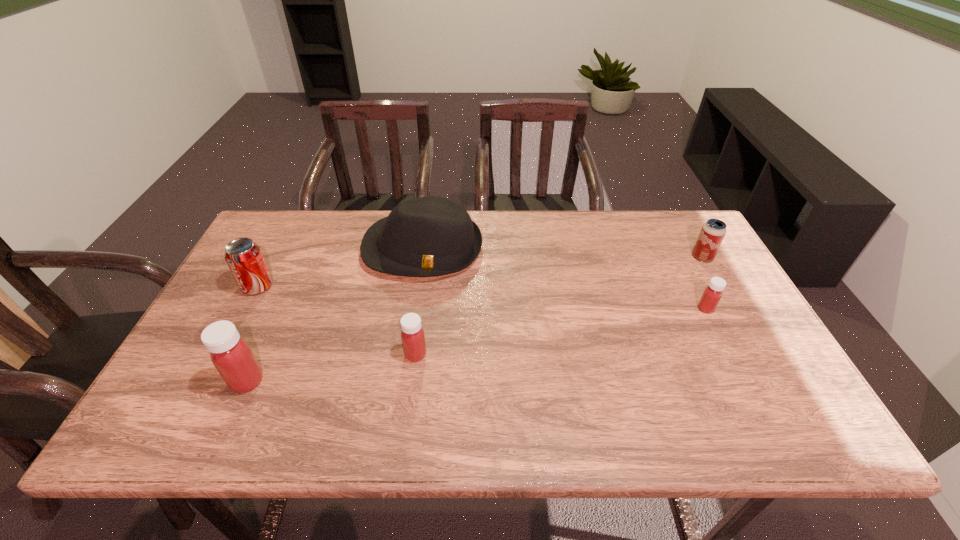
To achieve uniform spacing by inserting another medicine among them, please point to a free space for this new medicine. Please provide its 2D coordinates. Your answer should be formatted as a tuple, i.e. [(x, y)], where the tuple contains the x and y coordinates of a point satisfying the conditions above.

[(567, 330)]